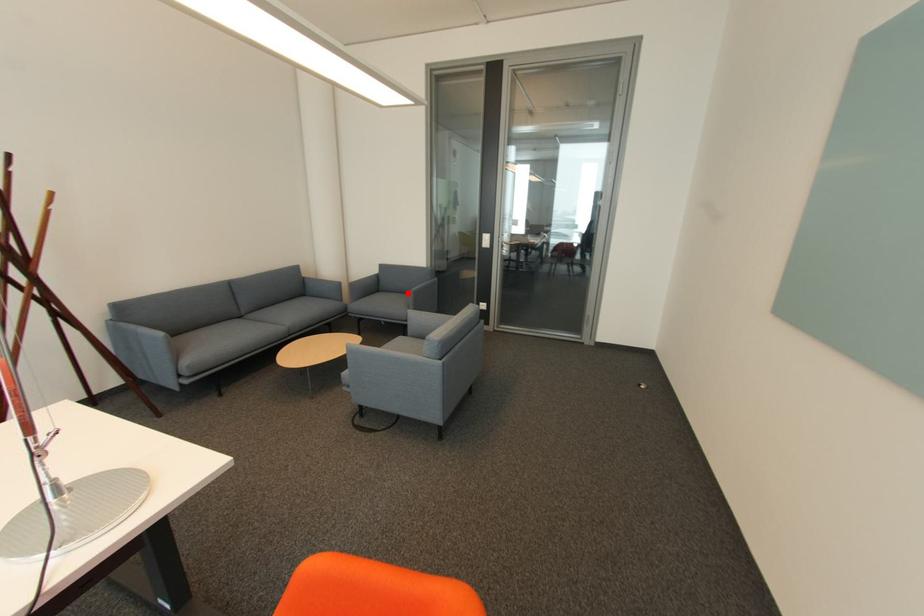
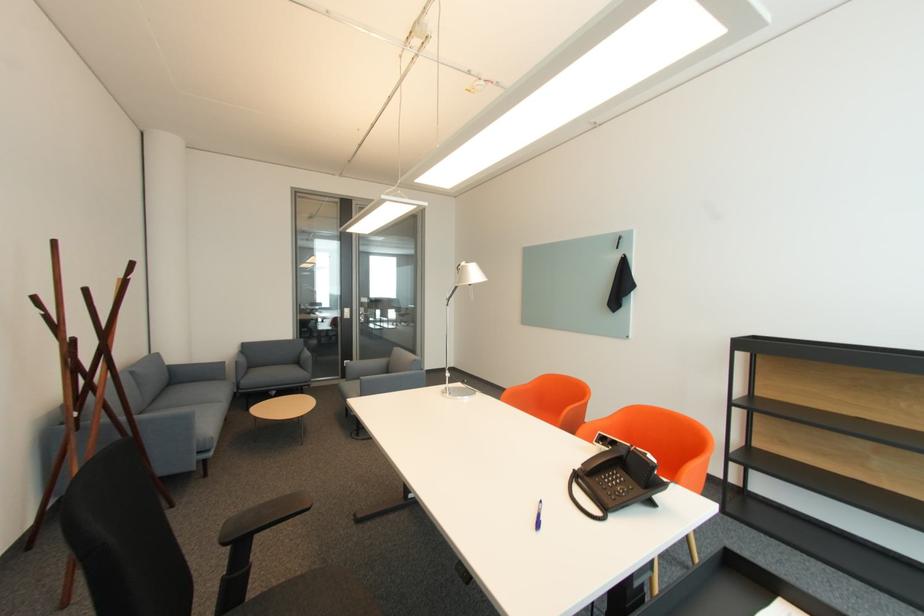
Where in the second image is the point corresponding to the highlighted location from the first image?

(282, 365)